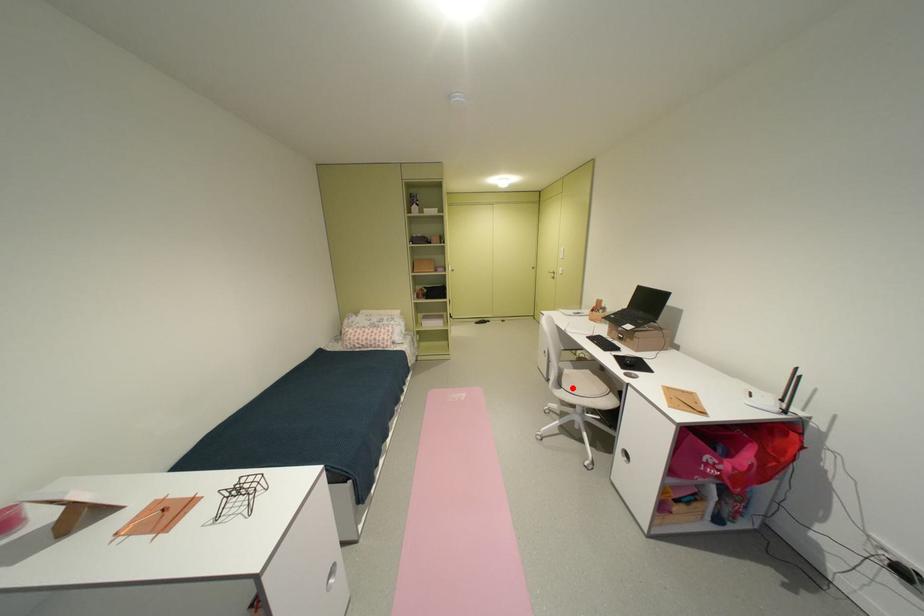
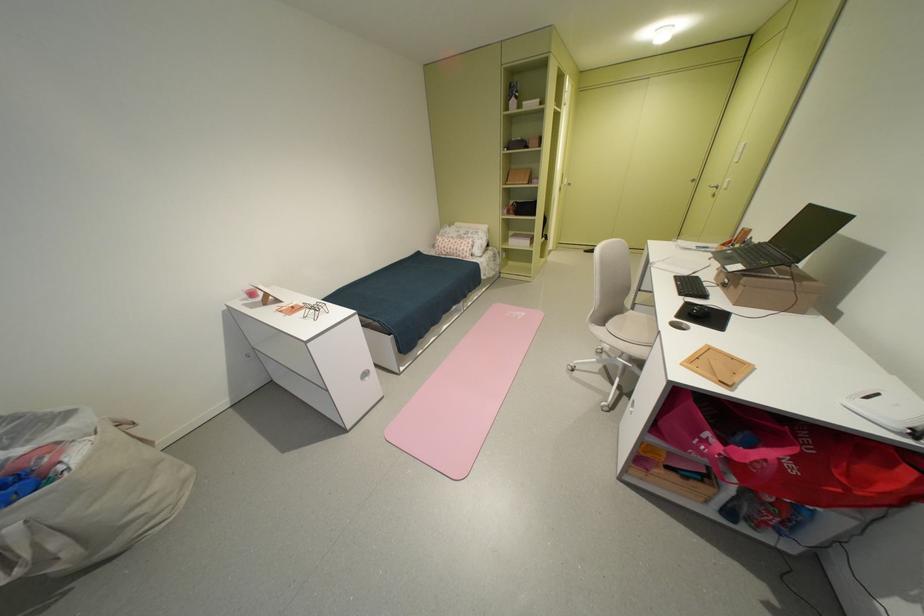
Locate, in the second image, the point that corresponds to the highlighted location in the first image.

(615, 326)